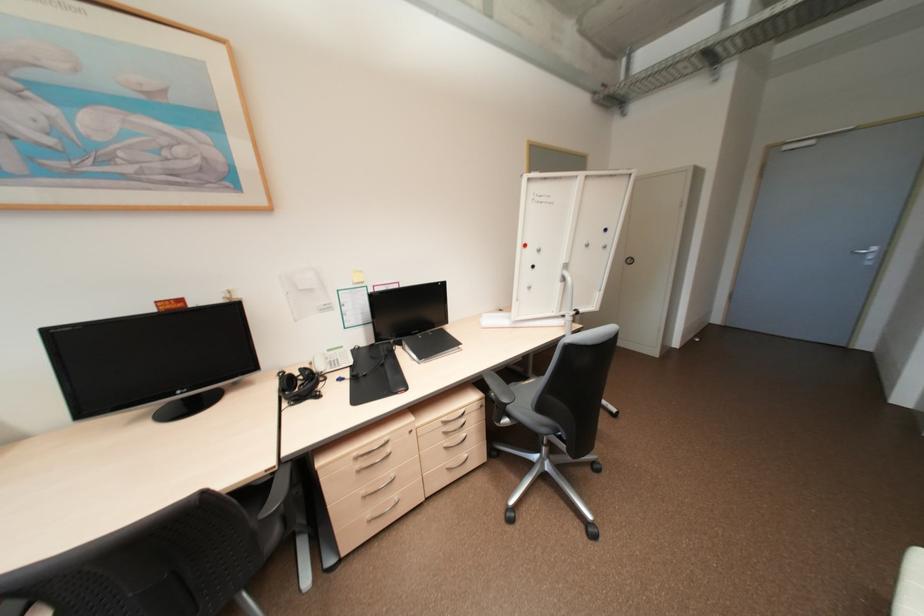
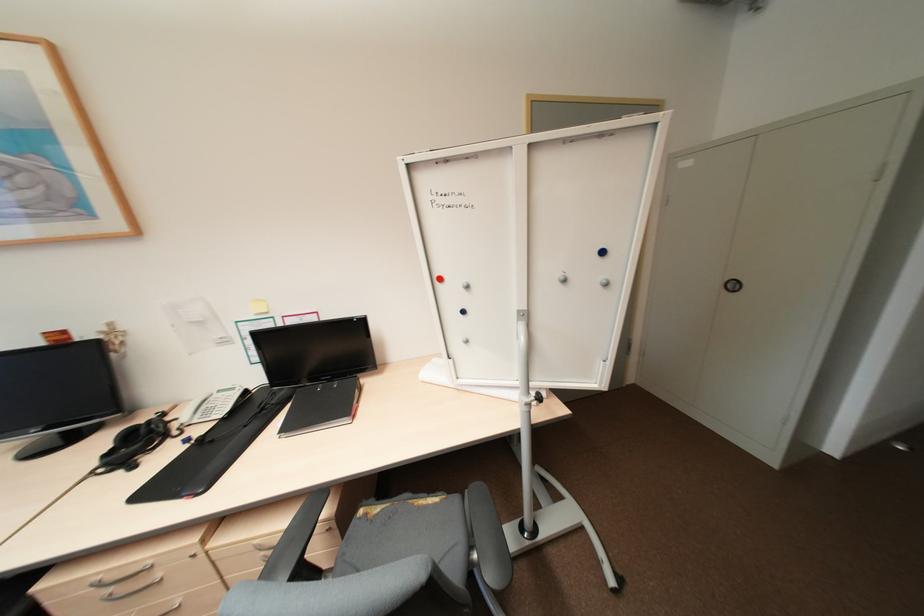
Where in the second image is the point corresponding to (611,246) from the first image?

(612, 284)